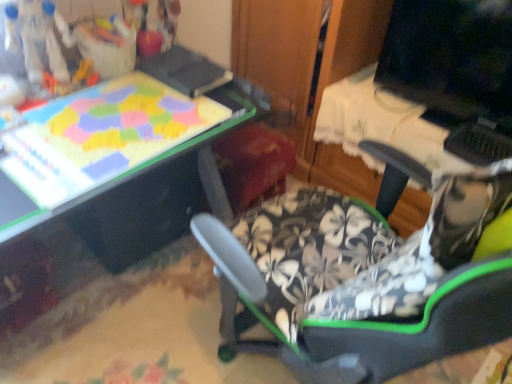
Question: Can you confirm if matte plastic puzzle board at upper left is wider than matte black monitor at upper right?

Choices:
 (A) yes
 (B) no

Answer: (A)

Question: Is the depth of matte plastic puzzle board at upper left less than that of matte black monitor at upper right?

Choices:
 (A) yes
 (B) no

Answer: (A)

Question: Could you tell me if matte plastic puzzle board at upper left is turned towards matte black monitor at upper right?

Choices:
 (A) no
 (B) yes

Answer: (A)

Question: Are matte plastic puzzle board at upper left and matte black monitor at upper right beside each other?

Choices:
 (A) no
 (B) yes

Answer: (A)

Question: Is matte black monitor at upper right at the back of matte plastic puzzle board at upper left?

Choices:
 (A) yes
 (B) no

Answer: (B)

Question: From a real-world perspective, is matte plastic puzzle board at upper left physically below matte black monitor at upper right?

Choices:
 (A) yes
 (B) no

Answer: (A)

Question: From a real-world perspective, is matte plastic puzzle board at upper left beneath black plastic drawer at lower left?

Choices:
 (A) no
 (B) yes

Answer: (A)

Question: Are matte plastic puzzle board at upper left and black plastic drawer at lower left beside each other?

Choices:
 (A) yes
 (B) no

Answer: (B)

Question: Can you confirm if matte plastic puzzle board at upper left is smaller than black plastic drawer at lower left?

Choices:
 (A) no
 (B) yes

Answer: (B)

Question: Could you tell me if matte plastic puzzle board at upper left is turned towards black plastic drawer at lower left?

Choices:
 (A) no
 (B) yes

Answer: (A)

Question: Is black plastic drawer at lower left a part of matte plastic puzzle board at upper left?

Choices:
 (A) no
 (B) yes

Answer: (A)

Question: Can you confirm if matte plastic puzzle board at upper left is bigger than black plastic drawer at lower left?

Choices:
 (A) no
 (B) yes

Answer: (A)

Question: Can you confirm if matte black monitor at upper right is positioned to the right of black plastic drawer at lower left?

Choices:
 (A) yes
 (B) no

Answer: (A)